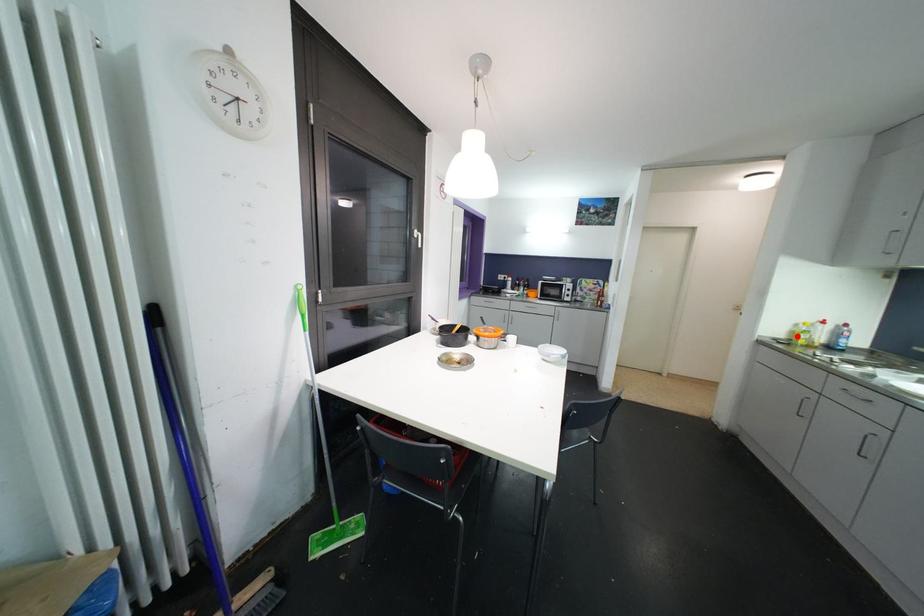
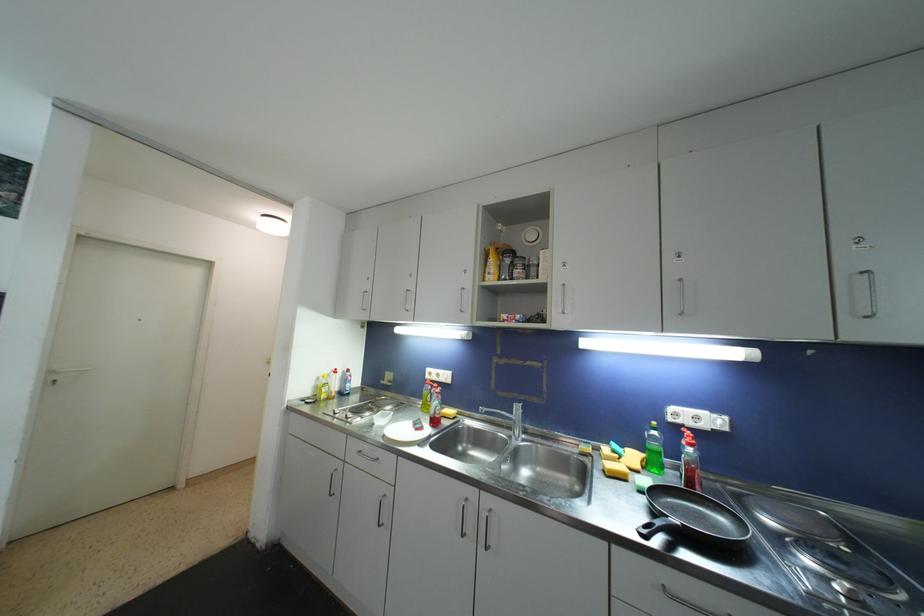
Question: I am providing you with two images of the same scene from different viewpoints. Image1 has a red point marked. In image2, the corresponding 3D location appears at what relative position? Reply with the corresponding letter.

Choices:
 (A) Closer
 (B) Farther

Answer: (B)